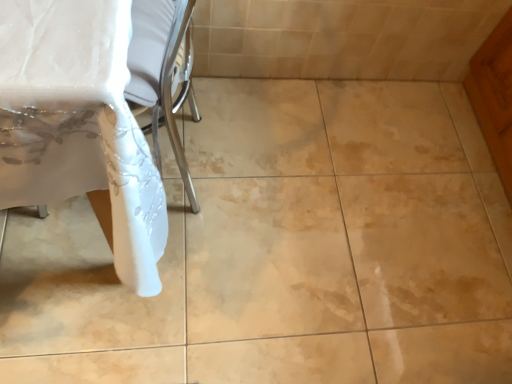
At what (x,y) coordinates should I click in order to perform the action: click on free space in front of white fabric tablecloth at left. Please return your answer as a coordinate pair (x, y). The width and height of the screenshot is (512, 384). Looking at the image, I should click on (131, 328).